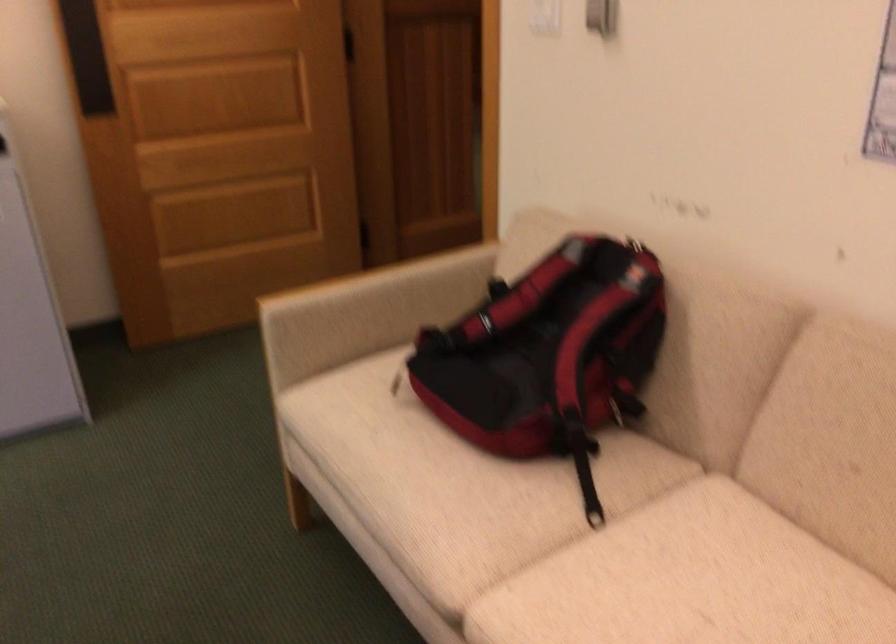
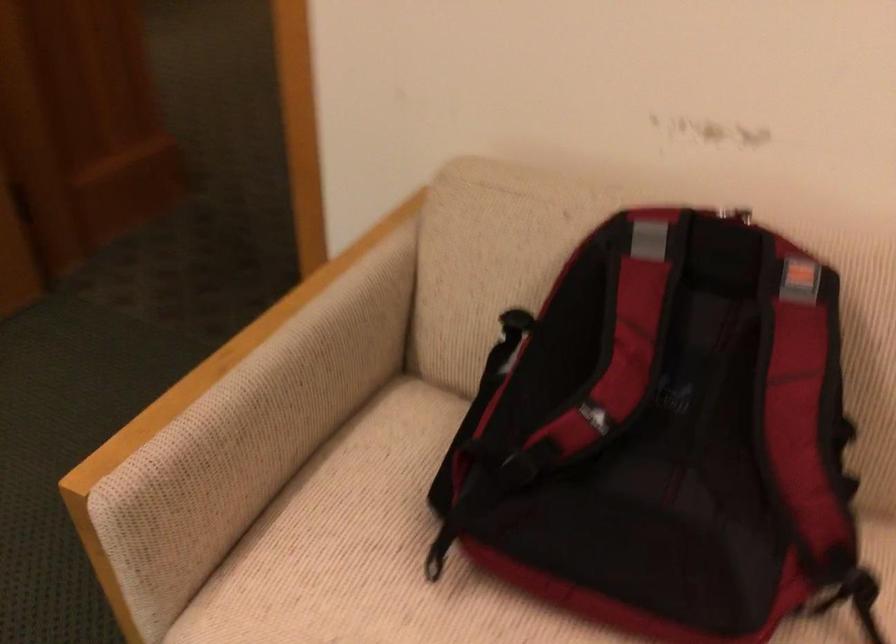
Question: The images are taken continuously from a first-person perspective. In which direction is your viewpoint rotating?

Choices:
 (A) Left
 (B) Right
 (C) Up
 (D) Down

Answer: (B)